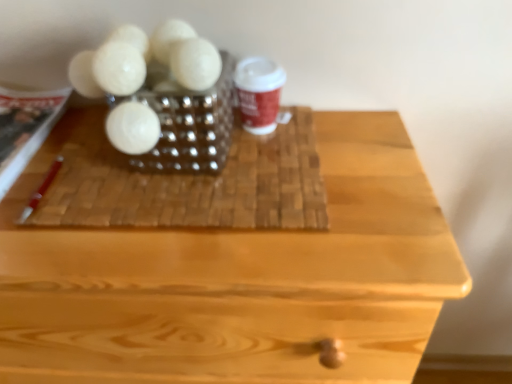
The height and width of the screenshot is (384, 512). What do you see at coordinates (236, 279) in the screenshot? I see `wooden table at center` at bounding box center [236, 279].

Where is `wooden table at center`? wooden table at center is located at coordinates (236, 279).

Locate an element on the screen. The width and height of the screenshot is (512, 384). wooden table at center is located at coordinates (236, 279).